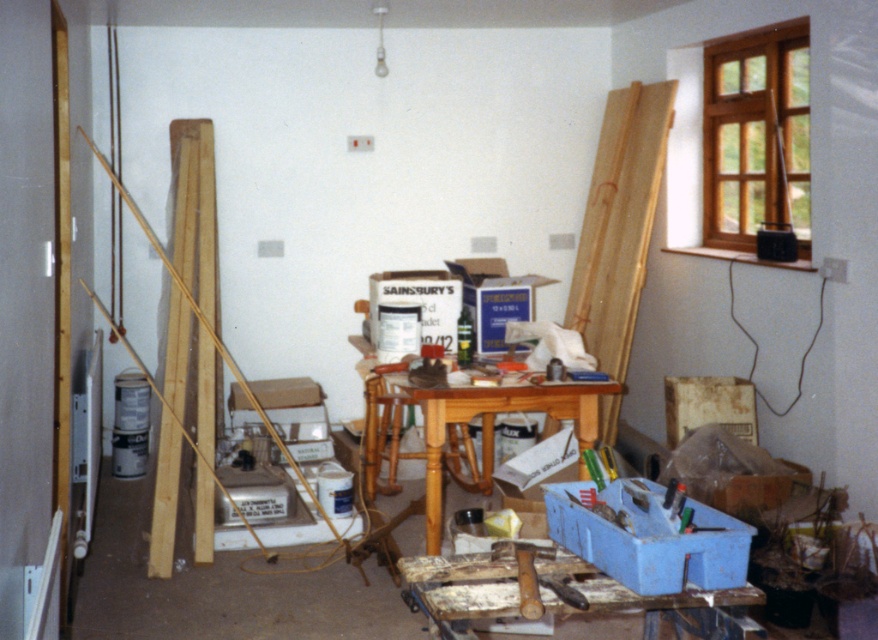
You are a construction worker standing at the entrance of the room. You need to reach the window on the right to check its frame. The ladder you have is the light brown wooden ladder at center. Can you use it to reach the window?

The light brown wooden ladder at center is positioned at point (619,221), which is near the center of the room. Since the window is on the right side, the ladder is not close enough to reach it directly. You would need to move the ladder closer to the window to use it effectively.

You are a painter who needs to reach a high spot on the wall. You have a light brown wooden ladder at center and a wooden table at center. Which object should you use to stand on to reach the high spot?

The light brown wooden ladder at center is above the wooden table at center, so it is more elevated and suitable for reaching high spots.